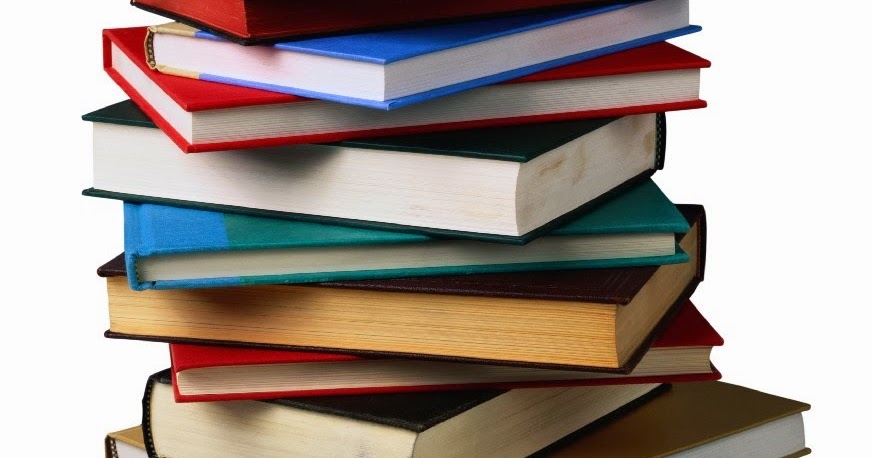
In order to click on books in this screenshot , I will do `click(274, 21)`, `click(318, 78)`, `click(278, 106)`, `click(392, 178)`, `click(346, 254)`, `click(373, 317)`, `click(351, 373)`, `click(376, 432)`, `click(706, 419)`.